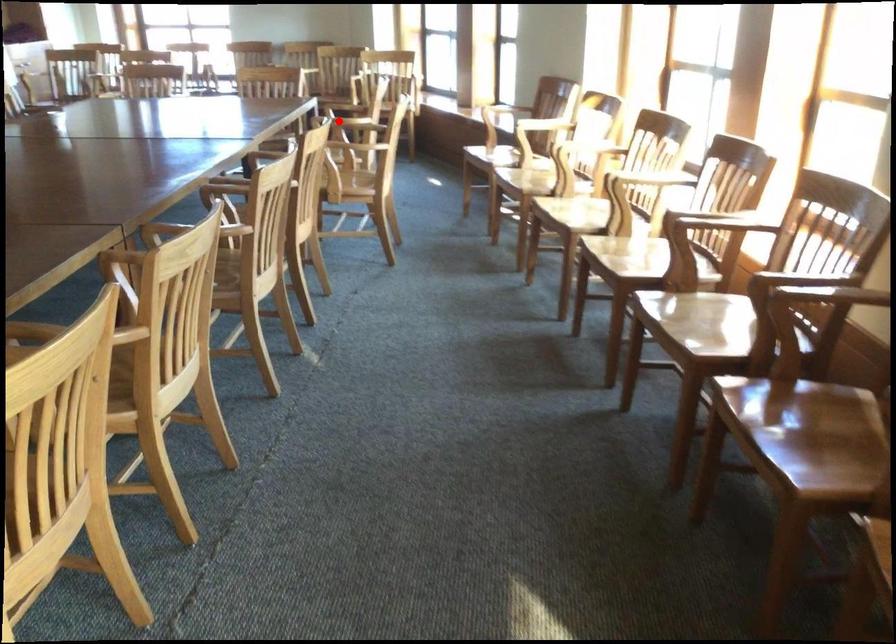
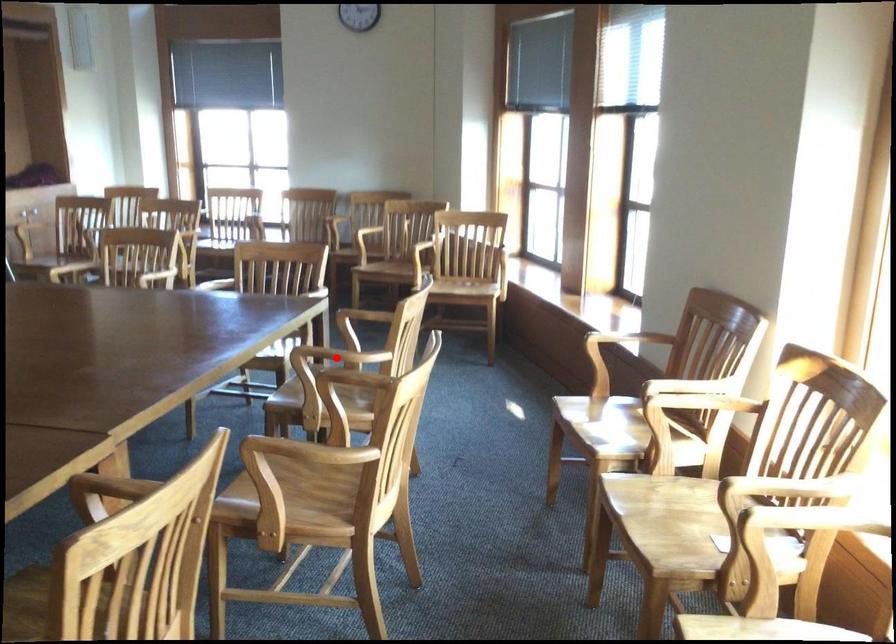
I am providing you with two images of the same scene from different viewpoints. A red point is marked on the first image and another point is marked on the second image. Do the highlighted points in image1 and image2 indicate the same real-world spot?

Yes